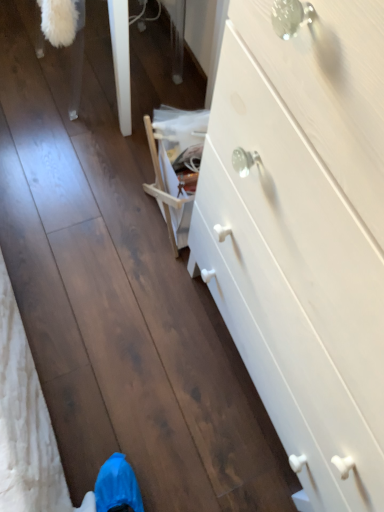
The height and width of the screenshot is (512, 384). I want to click on white wood chest of drawers at right, so click(303, 236).

This screenshot has width=384, height=512. Describe the element at coordinates (303, 236) in the screenshot. I see `white wood chest of drawers at right` at that location.

Measure the distance between white wood chest of drawers at right and camera.

13.78 inches.

Locate an element on the screen. white wood chest of drawers at right is located at coordinates (303, 236).